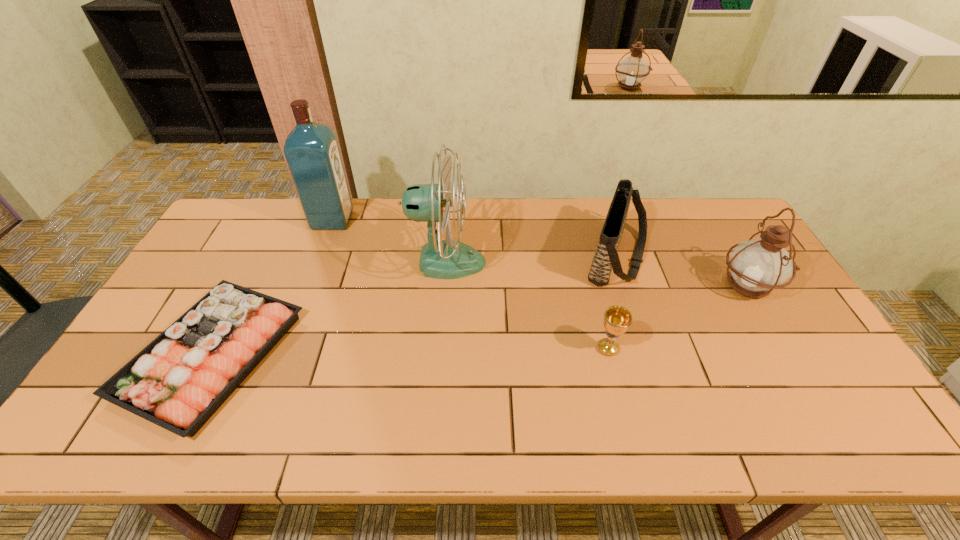
Identify the location of free space that satisfies the following two spatial constraints: 1. on the flat label side of the liquor; 2. on the back side of the handbag. (318, 258).

Where is `vacant space that satisfies the following two spatial constraints: 1. on the flat label side of the fourth tallest object; 2. on the left side of the liquor`? The image size is (960, 540). vacant space that satisfies the following two spatial constraints: 1. on the flat label side of the fourth tallest object; 2. on the left side of the liquor is located at coordinates click(x=318, y=258).